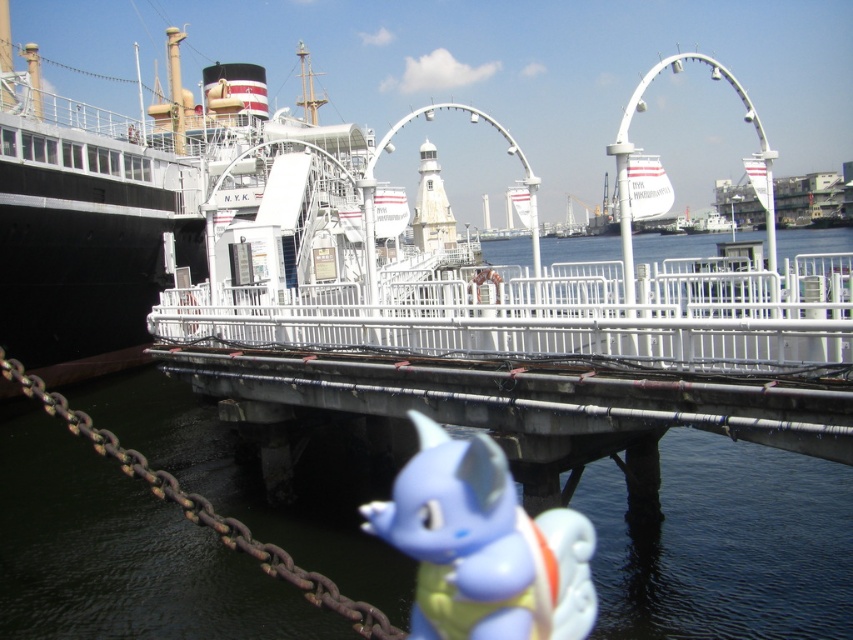
In the scene shown: You are a delivery drone with a 1.5 meter wingspan. You need to fly from the white metal bridge at center to the blue rubber toy at lower center. Can you safely navigate the space between them without hitting any obstacles?

The distance between the white metal bridge at center and the blue rubber toy at lower center is 6.56 meters. Since your drone has a wingspan of 1.5 meters, there is sufficient space to navigate safely between them as the distance is much larger than the drone size.

You are a child visiting the waterfront and see the white metal bridge at center and the blue rubber toy at lower center. Which object is larger in size?

The white metal bridge at center is bigger than the blue rubber toy at lower center, so the white metal bridge at center is larger in size.